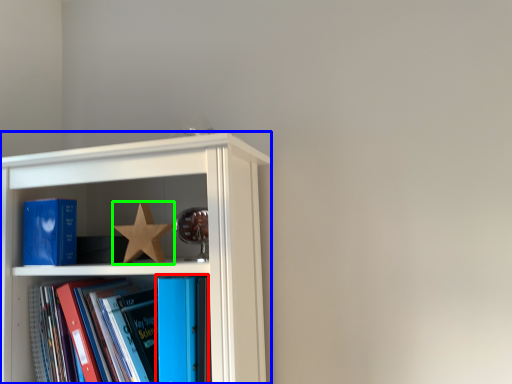
Question: Which object is the farthest from book (highlighted by a red box)? Choose among these: shelf (highlighted by a blue box) or star (highlighted by a green box).

Choices:
 (A) shelf
 (B) star

Answer: (A)